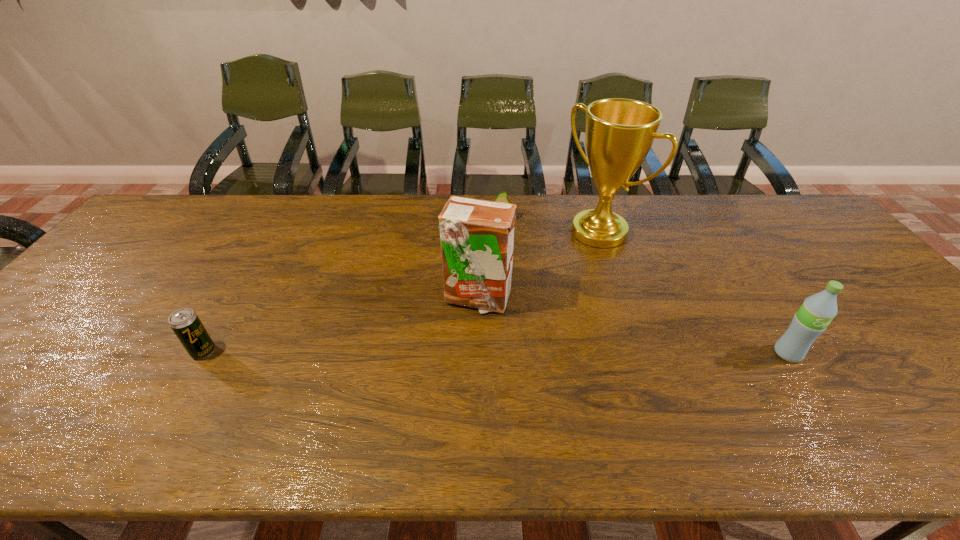
Find the location of a particular element. beer can is located at coordinates (185, 323).

Locate an element on the screen. water bottle is located at coordinates (817, 311).

What are the coordinates of `the rightmost object` in the screenshot? It's located at (817, 311).

Locate an element on the screen. Image resolution: width=960 pixels, height=540 pixels. avocado is located at coordinates click(x=502, y=197).

This screenshot has width=960, height=540. What are the coordinates of `the tallest object` in the screenshot? It's located at (619, 133).

I want to click on award, so tap(619, 133).

You are a GUI agent. You are given a task and a screenshot of the screen. Output one action in this format:
    pyautogui.click(x=<x>, y=<y>)
    Task: Click on the third farthest object
    
    Given the screenshot: What is the action you would take?
    pyautogui.click(x=477, y=236)

You are a GUI agent. You are given a task and a screenshot of the screen. Output one action in this format:
    pyautogui.click(x=<x>, y=<y>)
    Task: Click on the second tallest object
    This screenshot has width=960, height=540.
    Given the screenshot: What is the action you would take?
    pyautogui.click(x=477, y=236)

This screenshot has width=960, height=540. Find the location of `vacant area situated 0.270m on the right of the beer can`. vacant area situated 0.270m on the right of the beer can is located at coordinates (328, 352).

Locate an element on the screen. This screenshot has width=960, height=540. free space located 0.250m on the back of the rightmost object is located at coordinates (736, 275).